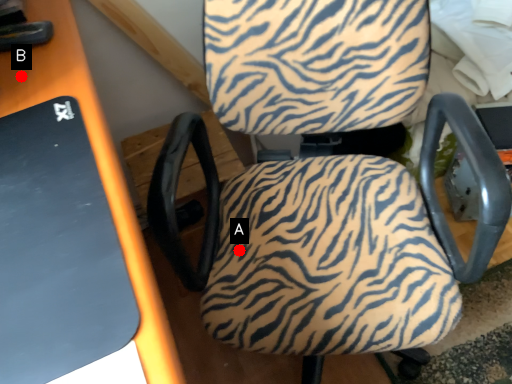
Question: Two points are circled on the image, labeled by A and B beside each circle. Which point is further to the camera?

Choices:
 (A) A is further
 (B) B is further

Answer: (A)